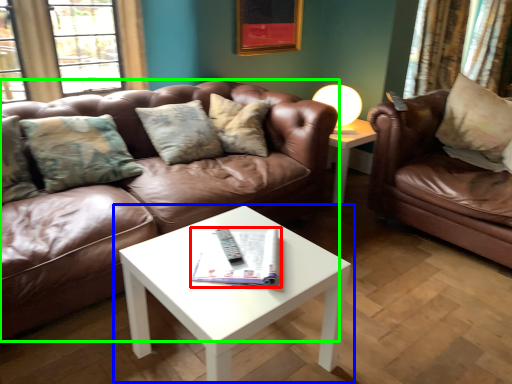
Question: Based on their relative distances, which object is nearer to magazine (highlighted by a red box)? Choose from coffee table (highlighted by a blue box) and studio couch (highlighted by a green box).

Choices:
 (A) coffee table
 (B) studio couch

Answer: (A)